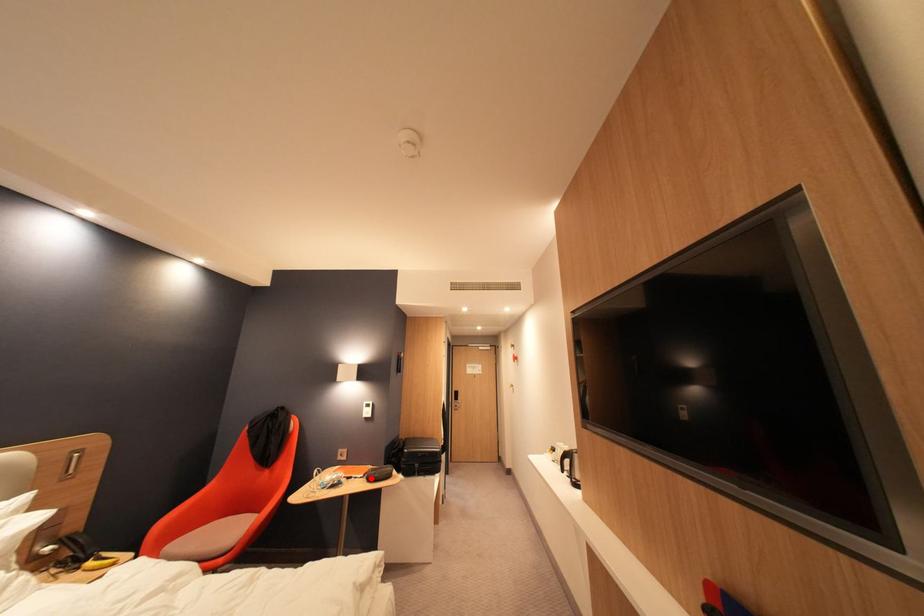
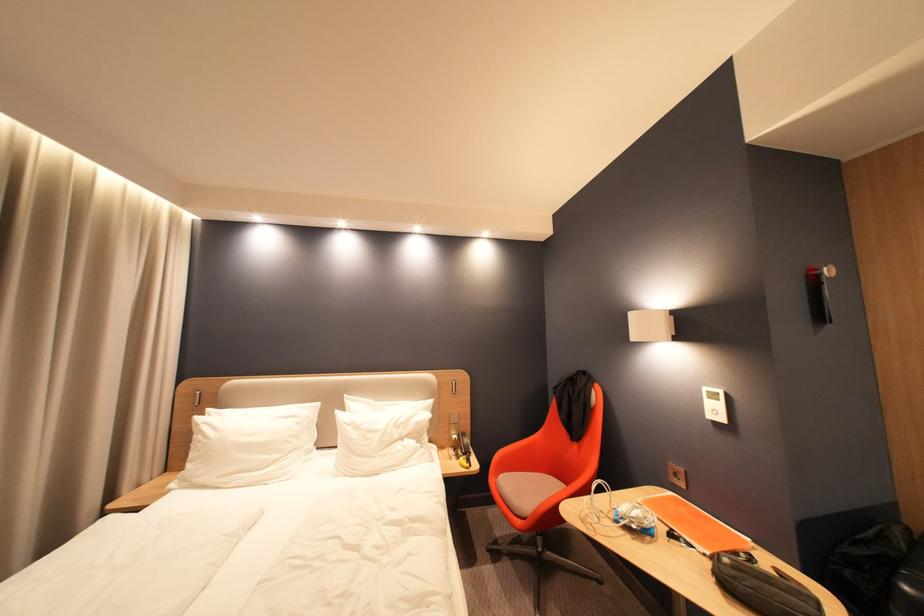
Locate, in the second image, the point that corresponds to the highlighted location in the first image.

(714, 556)